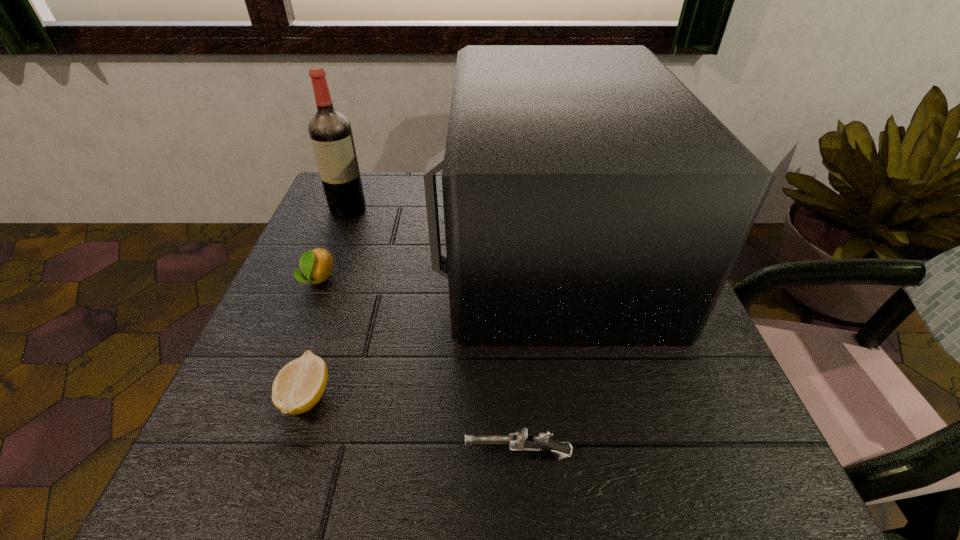
Locate an element on the screen. vacant space situated with leaves positioned above the farther lemon is located at coordinates (226, 507).

You are a GUI agent. You are given a task and a screenshot of the screen. Output one action in this format:
    pyautogui.click(x=<x>, y=<y>)
    Task: Click on the free region located 0.180m aimed along the barrel of the nearest object
    Image resolution: width=960 pixels, height=540 pixels.
    Given the screenshot: What is the action you would take?
    pyautogui.click(x=342, y=455)

The height and width of the screenshot is (540, 960). In order to click on vacant region located 0.150m aimed along the barrel of the nearest object in this screenshot , I will do click(362, 455).

Image resolution: width=960 pixels, height=540 pixels. Identify the location of blank area located aimed along the barrel of the nearest object. (321, 455).

The width and height of the screenshot is (960, 540). What are the coordinates of `free region located 0.210m on the back of the shortest object` in the screenshot? It's located at (344, 284).

Find the location of `microwave oven that is at the far edge`. microwave oven that is at the far edge is located at coordinates (590, 198).

Locate an element on the screen. liquor present at the far edge is located at coordinates (330, 132).

Image resolution: width=960 pixels, height=540 pixels. I want to click on object located in the near edge section of the desktop, so click(522, 440).

Identify the location of liquor present at the left edge. The width and height of the screenshot is (960, 540). (330, 132).

At what (x,y) coordinates should I click in order to perform the action: click on object at the right edge. Please return your answer as a coordinate pair (x, y). This screenshot has width=960, height=540. Looking at the image, I should click on (590, 198).